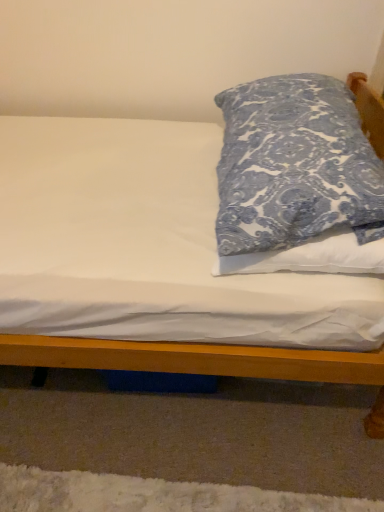
The height and width of the screenshot is (512, 384). What do you see at coordinates (204, 362) in the screenshot?
I see `white matte bed at center` at bounding box center [204, 362].

Where is `white matte bed at center`? This screenshot has width=384, height=512. white matte bed at center is located at coordinates (204, 362).

Where is `blue printed fabric pillow at upper right`? The image size is (384, 512). blue printed fabric pillow at upper right is located at coordinates point(295,165).

Image resolution: width=384 pixels, height=512 pixels. What do you see at coordinates (295, 165) in the screenshot? I see `blue printed fabric pillow at upper right` at bounding box center [295, 165].

Where is `white matte bed at center`? white matte bed at center is located at coordinates (204, 362).

Between blue printed fabric pillow at upper right and white matte bed at center, which one appears on the right side from the viewer's perspective?

From the viewer's perspective, blue printed fabric pillow at upper right appears more on the right side.

Is blue printed fabric pillow at upper right further to camera compared to white matte bed at center?

No, the depth of blue printed fabric pillow at upper right is less than that of white matte bed at center.

Between point (331, 212) and point (94, 365), which one is positioned in front?

Positioned in front is point (331, 212).

From the image's perspective, is blue printed fabric pillow at upper right located beneath white matte bed at center?

No.

From a real-world perspective, which object rests below the other?

white matte bed at center, from a real-world perspective.

Between blue printed fabric pillow at upper right and white matte bed at center, which one has larger width?

Wider between the two is white matte bed at center.

In terms of height, does blue printed fabric pillow at upper right look taller or shorter compared to white matte bed at center?

blue printed fabric pillow at upper right is taller than white matte bed at center.

Looking at this image, looking at the image, does blue printed fabric pillow at upper right seem bigger or smaller compared to white matte bed at center?

blue printed fabric pillow at upper right is smaller than white matte bed at center.

Can white matte bed at center be found inside blue printed fabric pillow at upper right?

No, blue printed fabric pillow at upper right does not contain white matte bed at center.

Is blue printed fabric pillow at upper right positioned far away from white matte bed at center?

No.

Is blue printed fabric pillow at upper right oriented towards white matte bed at center?

No, blue printed fabric pillow at upper right is not oriented towards white matte bed at center.

Can you tell me how much blue printed fabric pillow at upper right and white matte bed at center differ in facing direction?

blue printed fabric pillow at upper right and white matte bed at center are facing 178 degrees away from each other.

Where is `pillow above the white matte bed at center (from a real-world perspective)`? The height and width of the screenshot is (512, 384). pillow above the white matte bed at center (from a real-world perspective) is located at coordinates (295, 165).

Visually, is white matte bed at center positioned to the left or to the right of blue printed fabric pillow at upper right?

Based on their positions, white matte bed at center is located to the left of blue printed fabric pillow at upper right.

Does white matte bed at center come behind blue printed fabric pillow at upper right?

Yes, the depth of white matte bed at center is greater than that of blue printed fabric pillow at upper right.

Is point (121, 350) positioned in front of point (309, 190)?

No, it is not.

From the image's perspective, is white matte bed at center above or below blue printed fabric pillow at upper right?

From the image's perspective, white matte bed at center appears below blue printed fabric pillow at upper right.

From a real-world perspective, who is located higher, white matte bed at center or blue printed fabric pillow at upper right?

blue printed fabric pillow at upper right.

Considering the relative sizes of white matte bed at center and blue printed fabric pillow at upper right in the image provided, is white matte bed at center wider than blue printed fabric pillow at upper right?

Yes.

Can you confirm if white matte bed at center is shorter than blue printed fabric pillow at upper right?

Yes, white matte bed at center is shorter than blue printed fabric pillow at upper right.

Based on their sizes in the image, would you say white matte bed at center is bigger or smaller than blue printed fabric pillow at upper right?

Clearly, white matte bed at center is larger in size than blue printed fabric pillow at upper right.

Choose the correct answer: Is white matte bed at center inside blue printed fabric pillow at upper right or outside it?

white matte bed at center is not inside blue printed fabric pillow at upper right, it's outside.

Is white matte bed at center next to blue printed fabric pillow at upper right?

No, white matte bed at center is not with blue printed fabric pillow at upper right.

Is white matte bed at center aimed at blue printed fabric pillow at upper right?

No, white matte bed at center is not oriented towards blue printed fabric pillow at upper right.

How distant is white matte bed at center from blue printed fabric pillow at upper right?

white matte bed at center and blue printed fabric pillow at upper right are 18.78 inches apart from each other.

At what (x,y) coordinates should I click in order to perform the action: click on bed on the left of blue printed fabric pillow at upper right. Please return your answer as a coordinate pair (x, y). The height and width of the screenshot is (512, 384). Looking at the image, I should click on point(204,362).

Where is `bed on the left of blue printed fabric pillow at upper right`? Image resolution: width=384 pixels, height=512 pixels. bed on the left of blue printed fabric pillow at upper right is located at coordinates (204, 362).

Where is `bed below the blue printed fabric pillow at upper right (from a real-world perspective)`? bed below the blue printed fabric pillow at upper right (from a real-world perspective) is located at coordinates (204, 362).